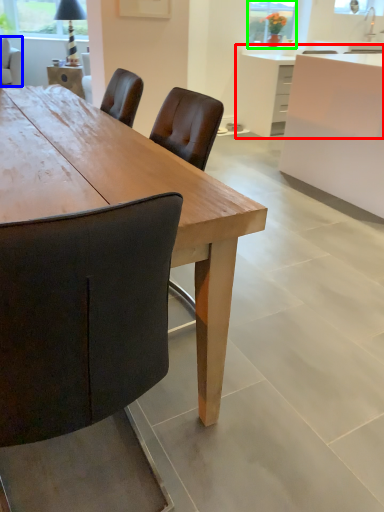
Question: Which is farther away from counter (highlighted by a red box)? chair (highlighted by a blue box) or window screen (highlighted by a green box)?

Choices:
 (A) chair
 (B) window screen

Answer: (A)